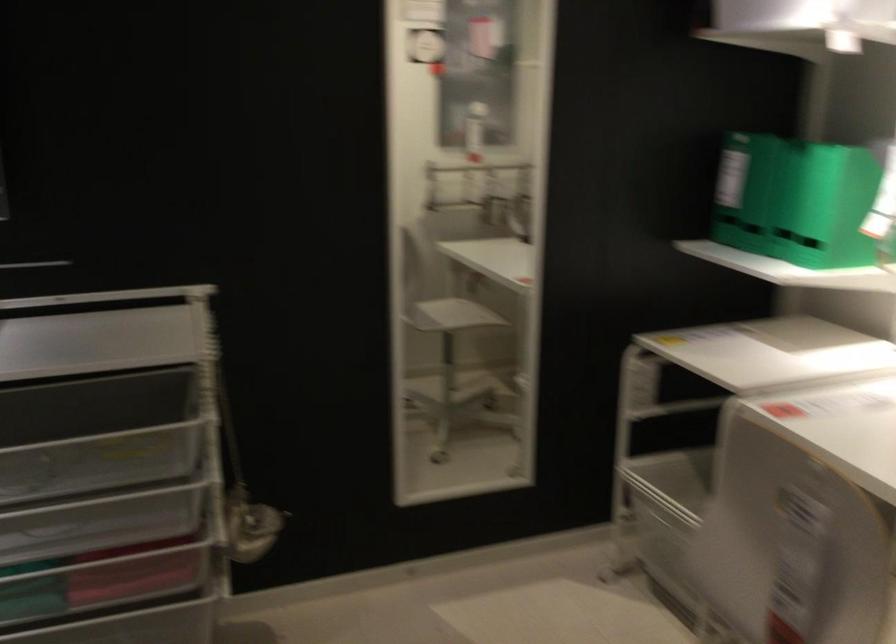
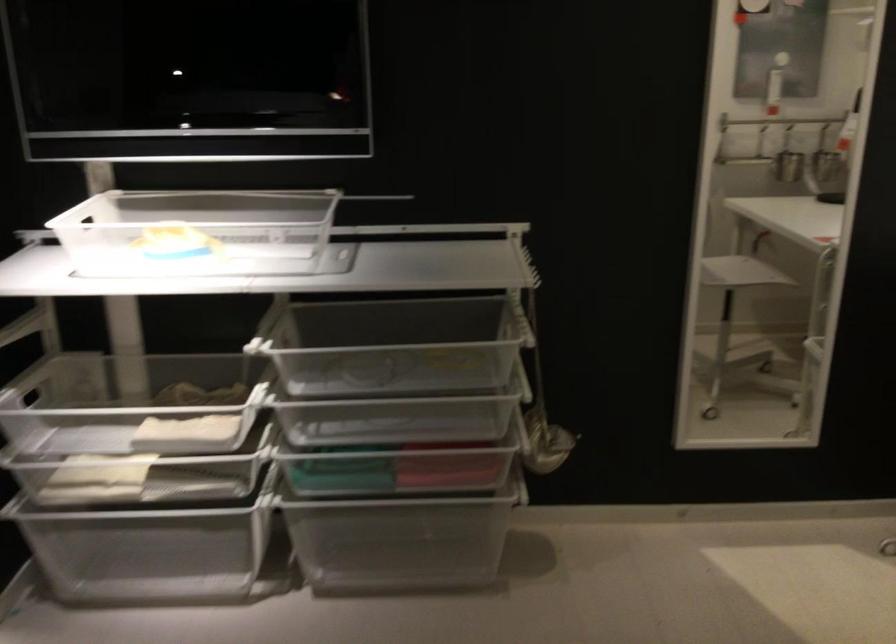
The point at (460, 319) is marked in the first image. Where is the corresponding point in the second image?

(739, 272)